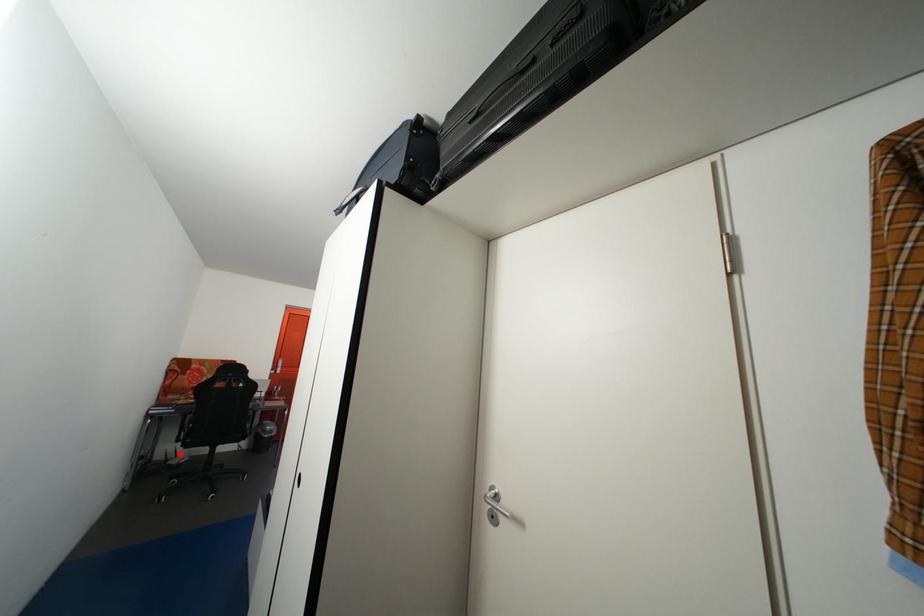
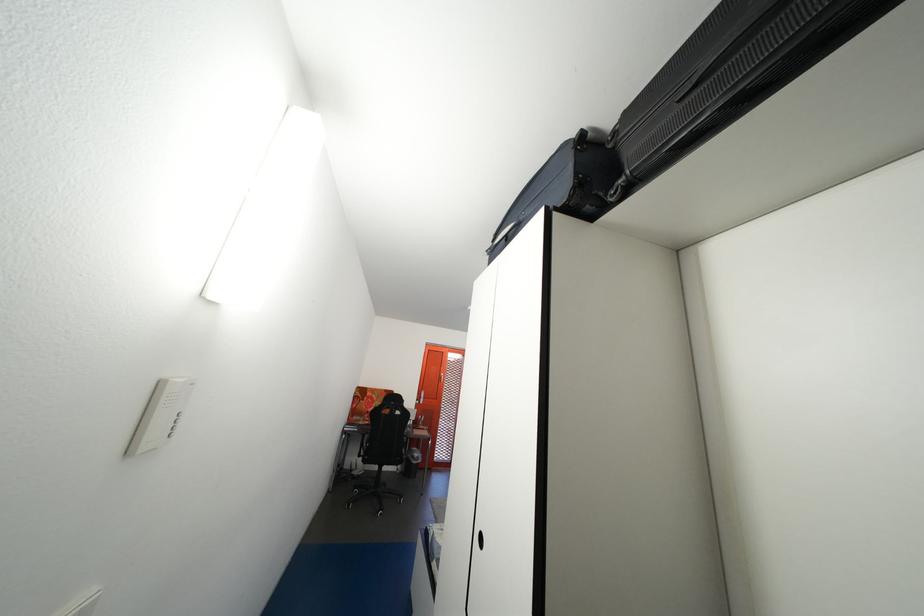
Question: I am providing you with two images of the same scene from different viewpoints. A red point is shown in image1. For the corresponding object point in image2, is it positioned nearer or farther from the camera?

Choices:
 (A) Nearer
 (B) Farther

Answer: (B)